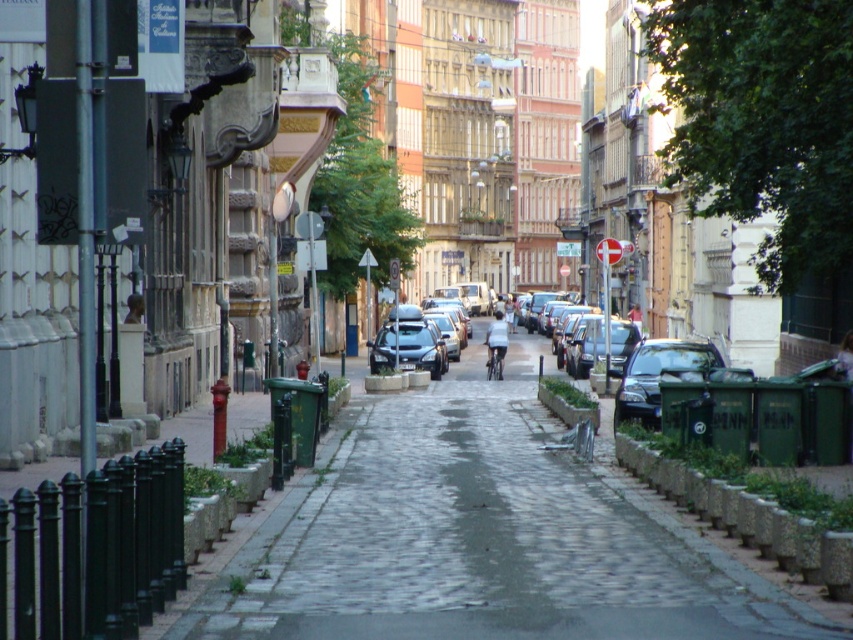
Question: Among these points, which one is farthest from the camera?

Choices:
 (A) (375, 637)
 (B) (381, 342)
 (C) (686, 353)
 (D) (589, 349)

Answer: (B)

Question: Which point is farther from the camera taking this photo?

Choices:
 (A) (412, 321)
 (B) (618, 400)

Answer: (A)

Question: Is cobblestone pavement at center to the left of metallic dark green car at right from the viewer's perspective?

Choices:
 (A) yes
 (B) no

Answer: (A)

Question: Is shiny black sedan at center in front of light blue fabric shirt at center?

Choices:
 (A) no
 (B) yes

Answer: (B)

Question: Does shiny black sedan at center have a smaller size compared to light blue fabric shirt at center?

Choices:
 (A) no
 (B) yes

Answer: (B)

Question: Which point is farther to the camera?

Choices:
 (A) light blue fabric shirt at center
 (B) shiny black sedan at center
 (C) metallic dark green car at right
 (D) cobblestone pavement at center

Answer: (A)